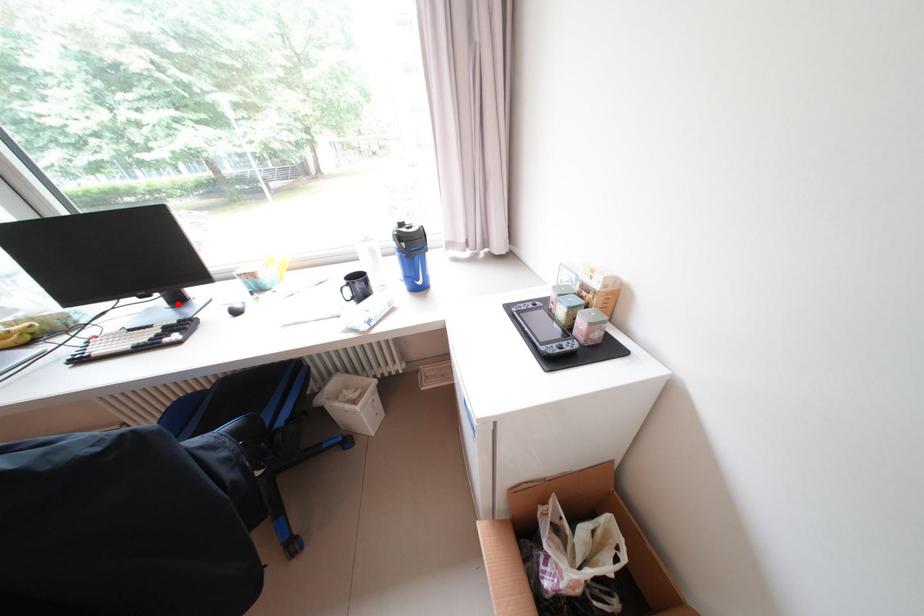
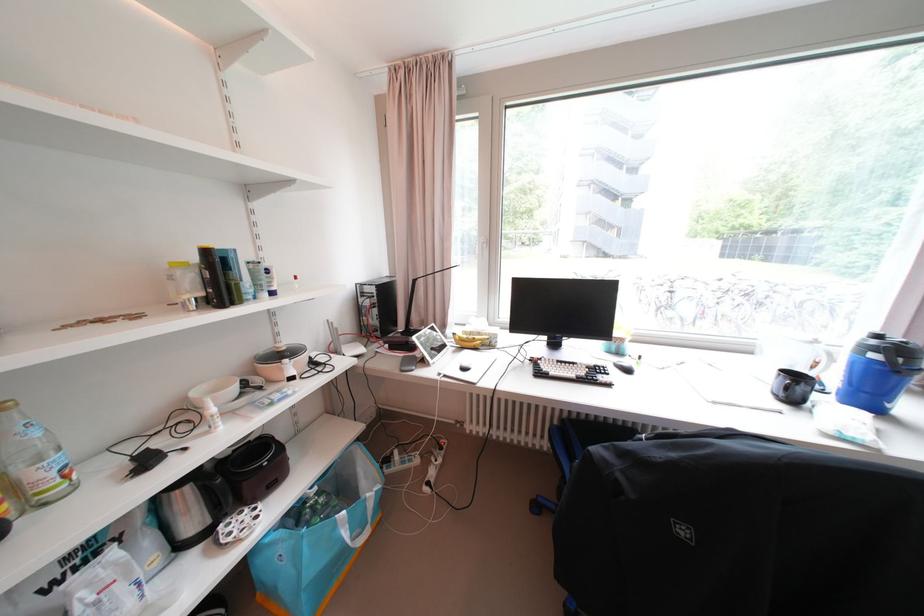
In the second image, find the point that corresponds to the highlighted location in the first image.

(555, 346)